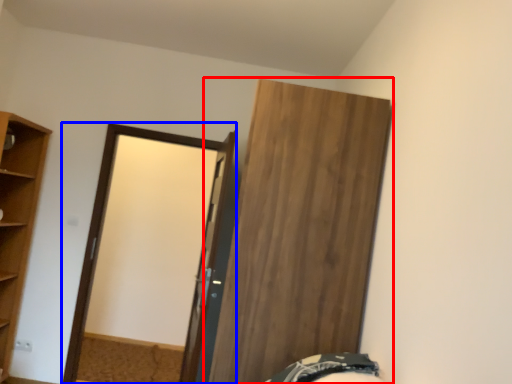
Question: Which point is closer to the camera, door (highlighted by a red box) or screen door (highlighted by a blue box)?

Choices:
 (A) door
 (B) screen door

Answer: (A)